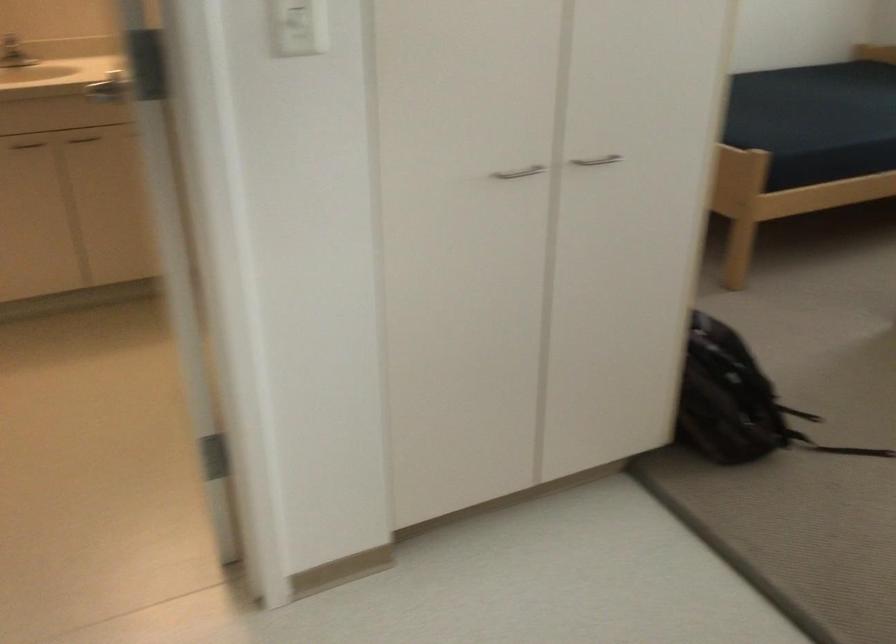
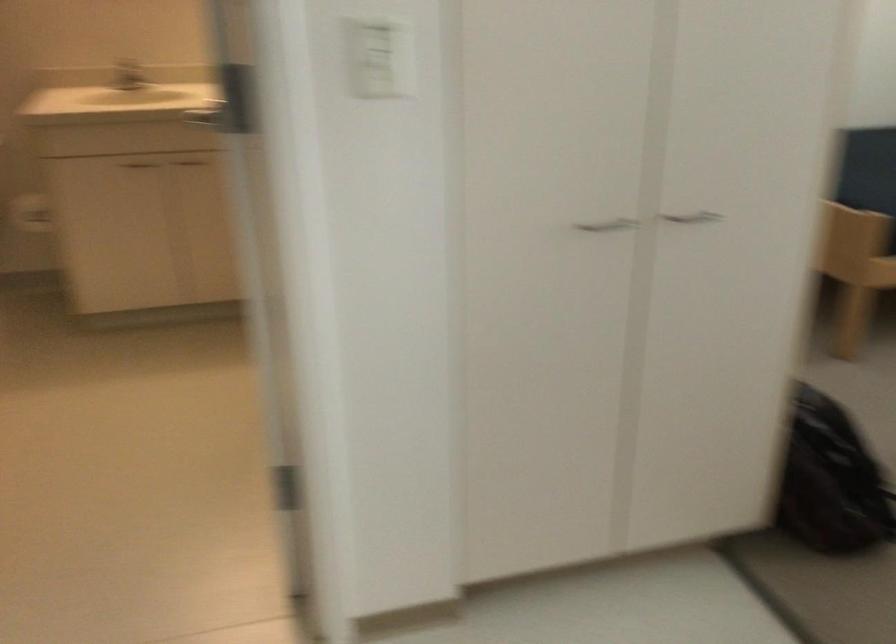
Locate, in the second image, the point that corresponds to the point at 622,149 in the first image.

(724, 205)